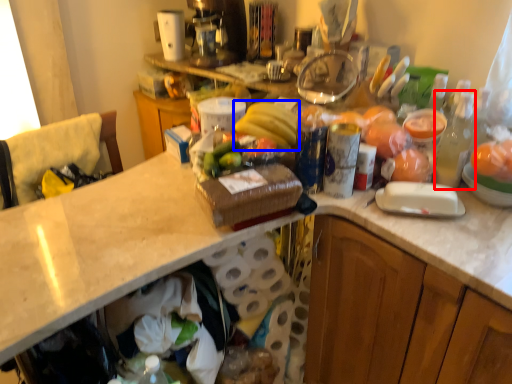
Question: Which point is further to the camera, bottle (highlighted by a red box) or banana (highlighted by a blue box)?

Choices:
 (A) bottle
 (B) banana

Answer: (B)